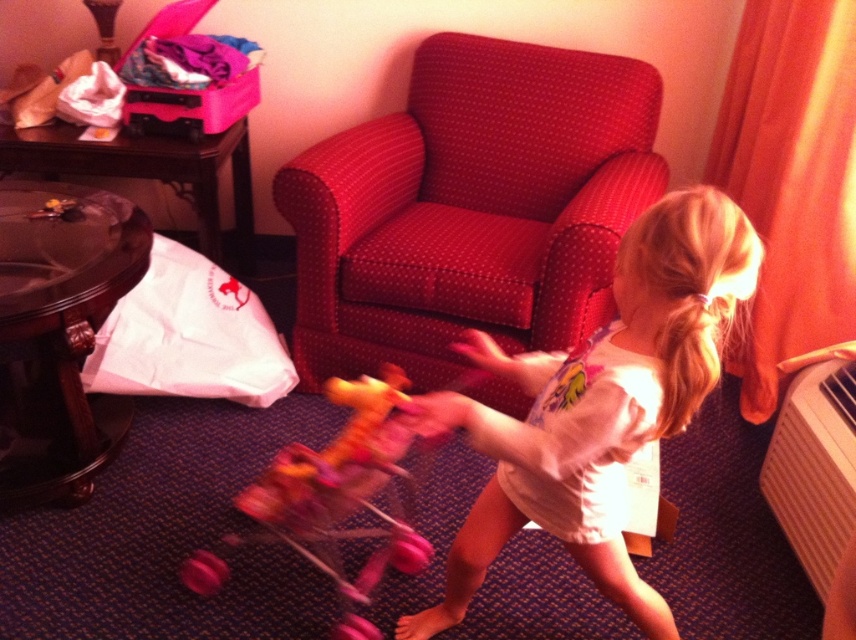
Between point (241, 502) and point (825, 595), which one is positioned in front?

Point (241, 502) is in front.

Between point (351, 474) and point (836, 432), which one is positioned behind?

The point (836, 432) is behind.

I want to click on pink plastic baby carriage at center, so click(x=343, y=493).

Between polka dot fabric armchair at center and white plastic radiator at lower right, which one is positioned higher?

Positioned higher is polka dot fabric armchair at center.

Who is more forward, [302,198] or [782,484]?

Point [782,484] is more forward.

Where is `polka dot fabric armchair at center`? Image resolution: width=856 pixels, height=640 pixels. polka dot fabric armchair at center is located at coordinates (470, 209).

Is polka dot fabric armchair at center taller than white cotton shirt at center?

Correct, polka dot fabric armchair at center is much taller as white cotton shirt at center.

Who is higher up, polka dot fabric armchair at center or white cotton shirt at center?

Positioned higher is polka dot fabric armchair at center.

The height and width of the screenshot is (640, 856). I want to click on polka dot fabric armchair at center, so click(470, 209).

In order to click on polka dot fabric armchair at center in this screenshot , I will do (x=470, y=209).